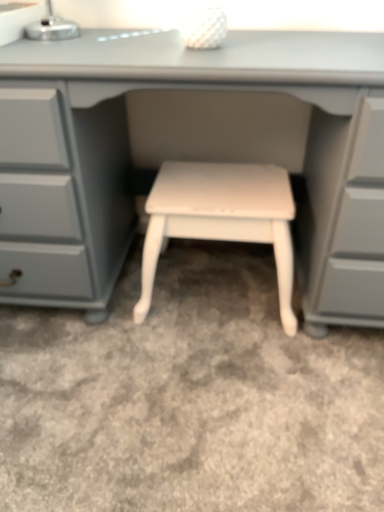
The height and width of the screenshot is (512, 384). I want to click on free space in front of white painted wood stool at center, so click(x=216, y=389).